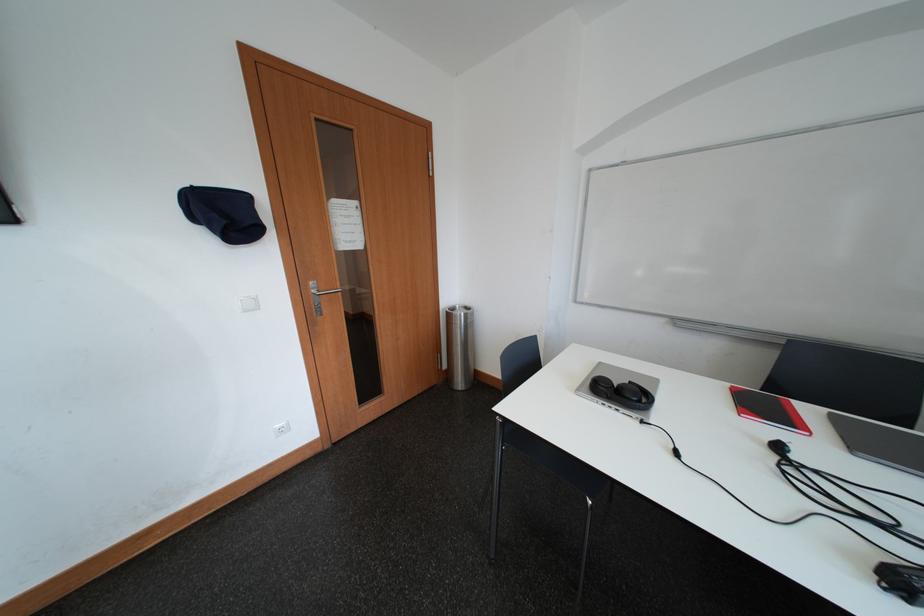
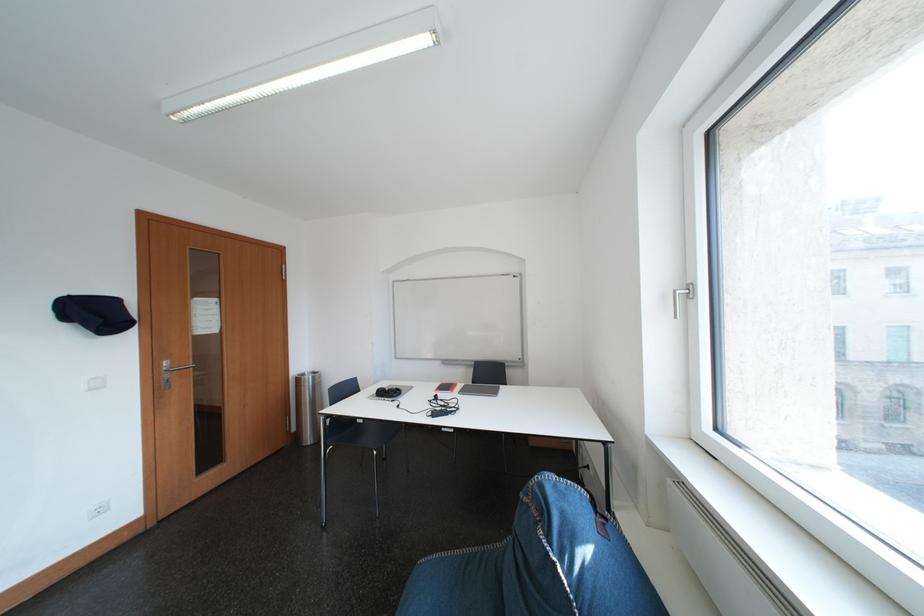
Find the pixel in the second image that matches (821,416) in the first image.

(470, 390)